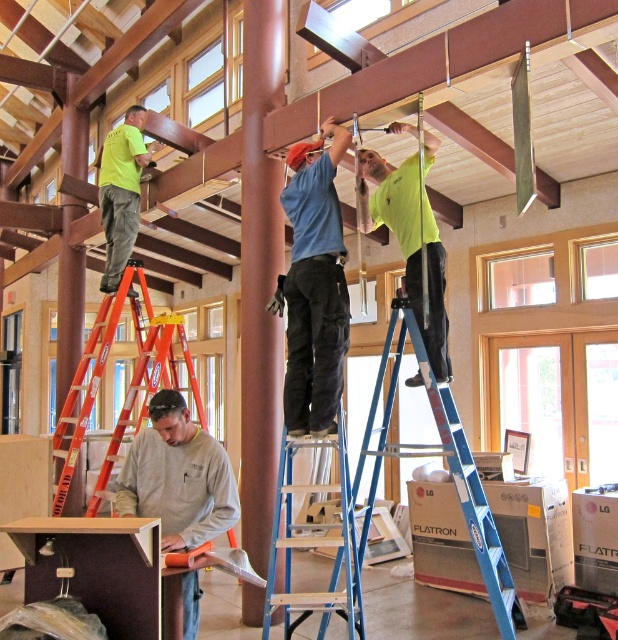
Question: Where is neon green shirt at upper left located in relation to orange ladder at lower left in the image?

Choices:
 (A) below
 (B) above

Answer: (B)

Question: Is blue denim jeans at center to the right of orange ladder at lower left from the viewer's perspective?

Choices:
 (A) yes
 (B) no

Answer: (A)

Question: Is blue aluminum ladder at center bigger than bright yellow shirt at upper center?

Choices:
 (A) no
 (B) yes

Answer: (B)

Question: Which point is farther to the camera?

Choices:
 (A) bright yellow shirt at upper center
 (B) blue metallic ladder at center

Answer: (A)

Question: Based on their relative distances, which object is farther from the gray matte shirt at center?

Choices:
 (A) blue denim jeans at center
 (B) bright yellow shirt at upper center
 (C) orange ladder at lower left
 (D) neon green shirt at upper left

Answer: (D)

Question: Which is farther from the bright yellow shirt at upper center?

Choices:
 (A) neon green shirt at upper left
 (B) gray matte shirt at center
 (C) blue denim jeans at center

Answer: (A)